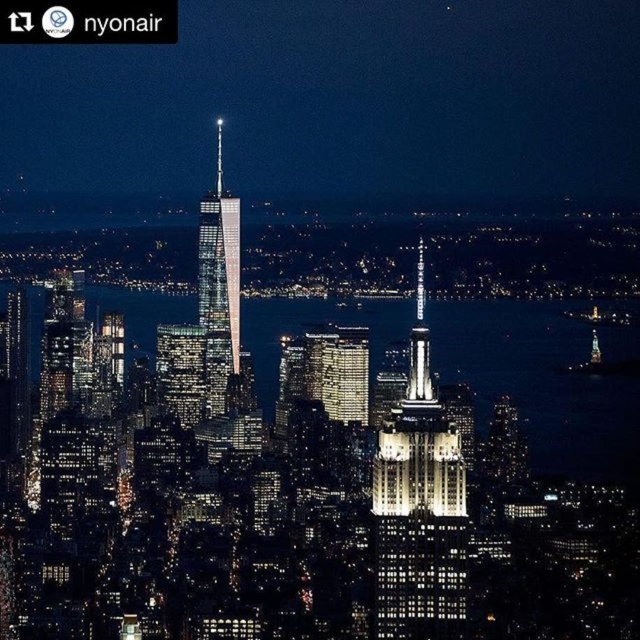
Can you confirm if white marble tower at center is positioned to the left of glassy reflective skyscraper at center?

No, white marble tower at center is not to the left of glassy reflective skyscraper at center.

Which is behind, point (404, 465) or point (205, 308)?

Point (404, 465)

Does point (422, 292) come farther from viewer compared to point (198, 305)?

No.

At what (x,y) coordinates should I click in order to perform the action: click on white marble tower at center. Please return your answer as a coordinate pair (x, y). Image resolution: width=640 pixels, height=640 pixels. Looking at the image, I should click on (419, 506).